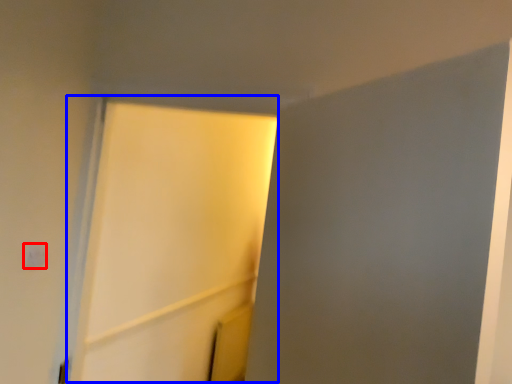
Question: Which of the following is the closest to the observer, light switch (highlighted by a red box) or screen door (highlighted by a blue box)?

Choices:
 (A) light switch
 (B) screen door

Answer: (B)